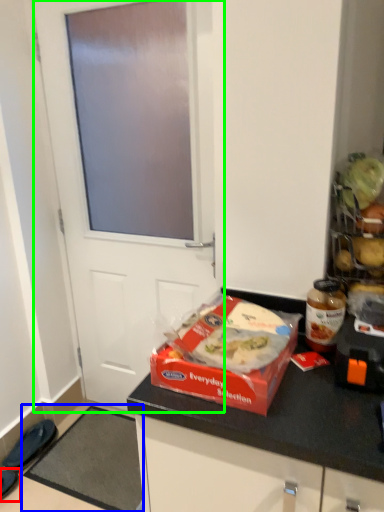
Question: Estimate the real-world distances between objects in this image. Which object is farther from footwear (highlighted by a red box), doormat (highlighted by a blue box) or door (highlighted by a green box)?

Choices:
 (A) doormat
 (B) door

Answer: (B)